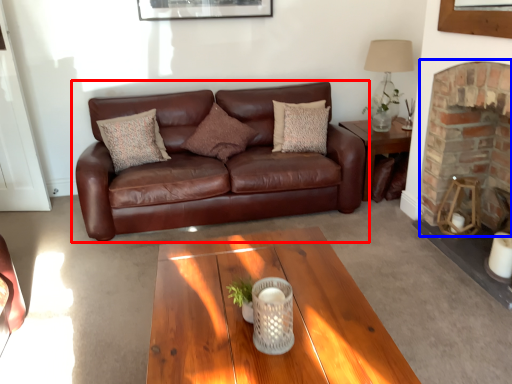
Question: Among these objects, which one is farthest to the camera, studio couch (highlighted by a red box) or fireplace (highlighted by a blue box)?

Choices:
 (A) studio couch
 (B) fireplace

Answer: (A)